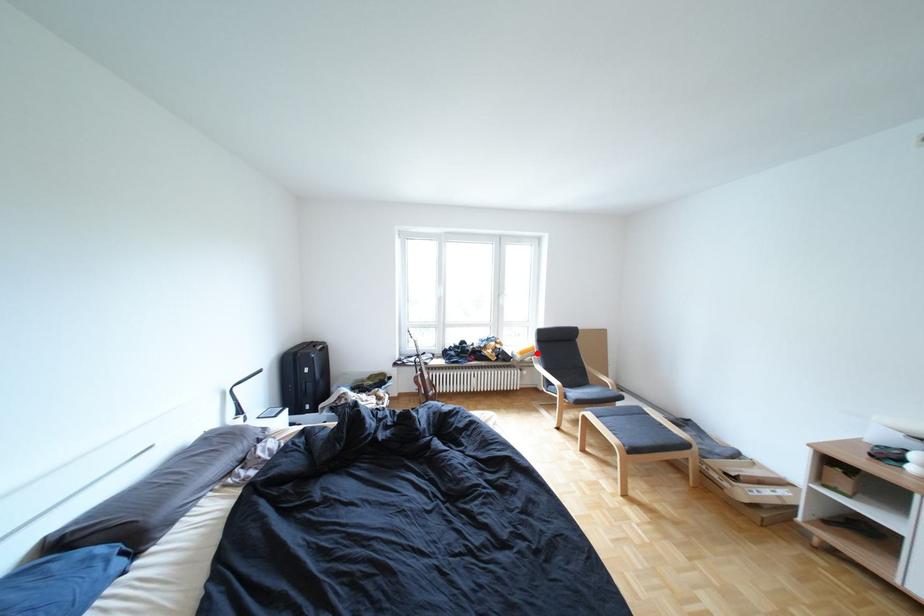
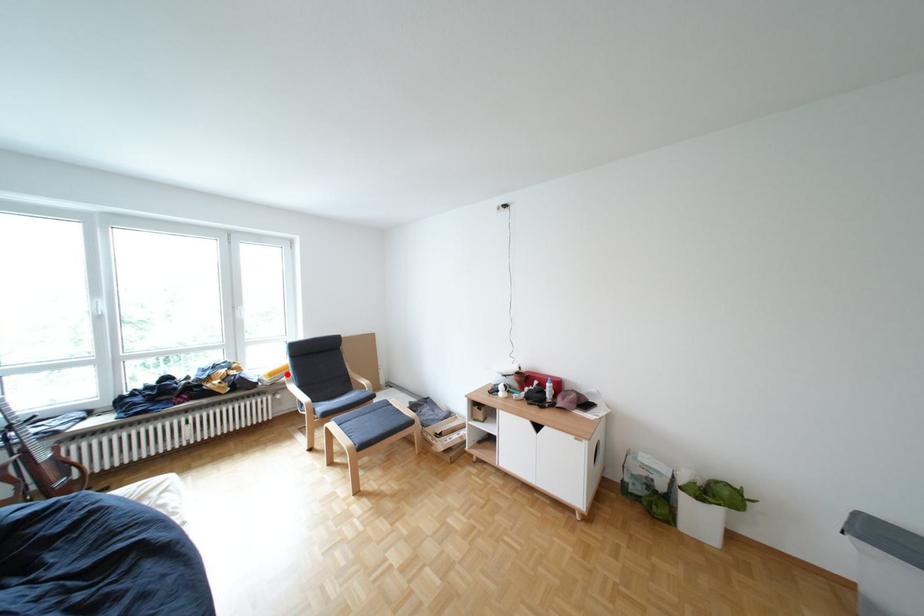
I am providing you with two images of the same scene from different viewpoints. A red point is marked on the first image and another point is marked on the second image. Do the highlighted points in image1 and image2 indicate the same real-world spot?

Yes